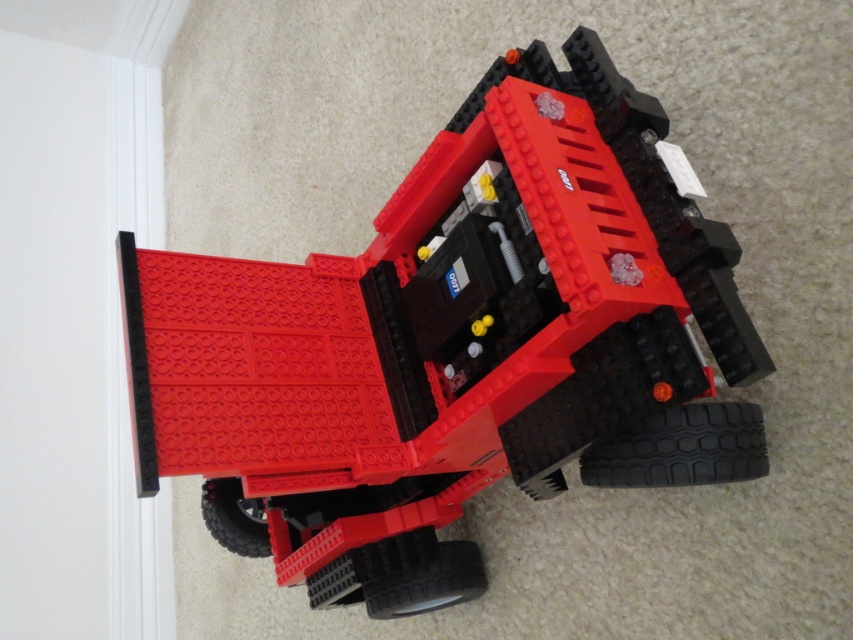
You are a child playing with toys and see the matte plastic toy car at center and the black rubber tire at lower center. Which toy is positioned more to the left?

The matte plastic toy car at center is positioned more to the left than the black rubber tire at lower center.

You are a small LEGO figure standing at the back of the LEGO truck. You want to move towards the front of the truck. Which point, point (x=398, y=592) or point (x=219, y=525), should you head toward?

You should head toward point (x=398, y=592) because it is in front of point (x=219, y=525), meaning it is closer to the front of the truck.